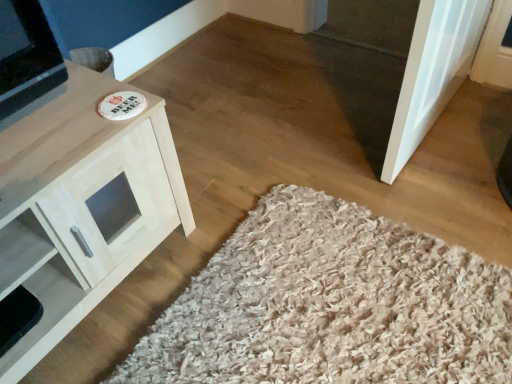
Image resolution: width=512 pixels, height=384 pixels. What do you see at coordinates (81, 203) in the screenshot? I see `light wood cabinet at left` at bounding box center [81, 203].

Locate an element on the screen. Image resolution: width=512 pixels, height=384 pixels. light wood cabinet at left is located at coordinates (81, 203).

Where is `light wood cabinet at left`? The height and width of the screenshot is (384, 512). light wood cabinet at left is located at coordinates click(x=81, y=203).